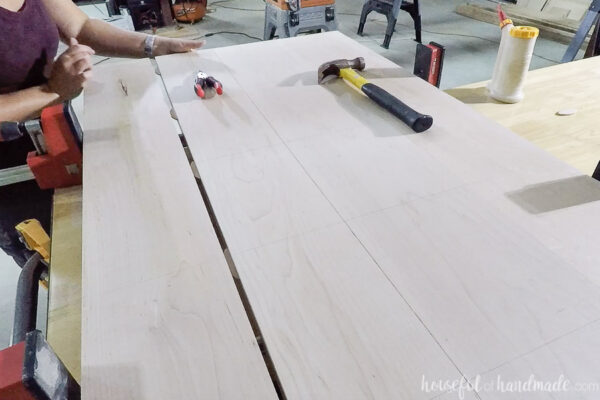
The height and width of the screenshot is (400, 600). In order to click on workplace floor in this screenshot , I will do `click(466, 55)`.